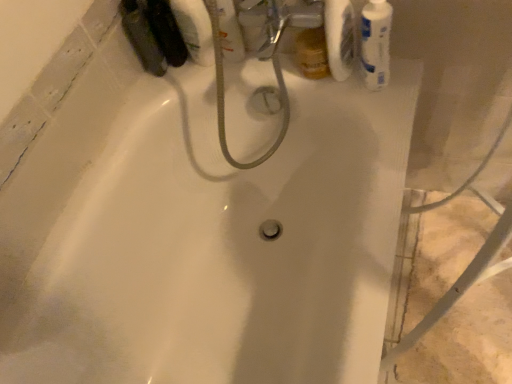
The image size is (512, 384). I want to click on free space in front of matte black bottle at upper left, the 1th mouthwash in the left-to-right sequence, so click(156, 99).